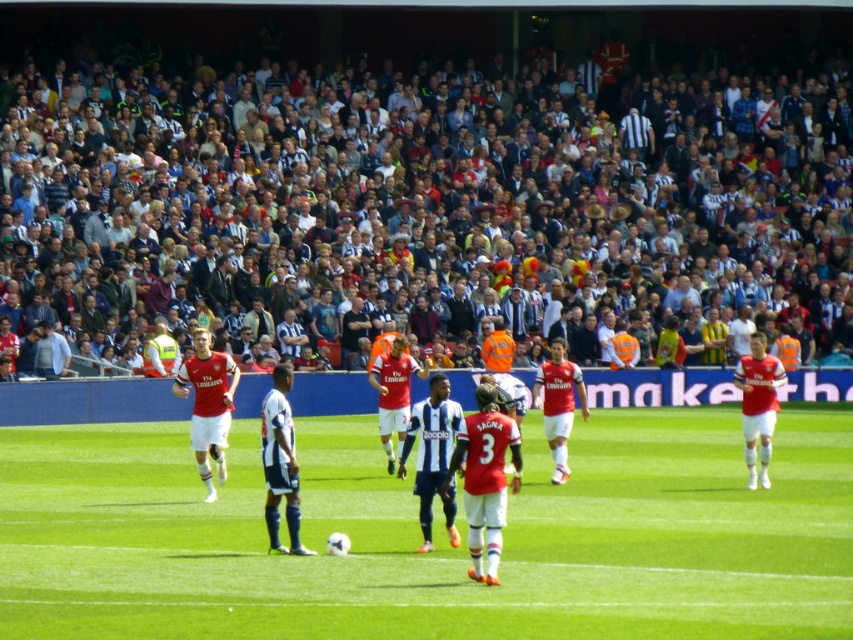
The width and height of the screenshot is (853, 640). Describe the element at coordinates (433, 536) in the screenshot. I see `white smooth soccer ball at center` at that location.

Measure the distance between point (793,576) and camera.

A distance of 17.58 meters exists between point (793,576) and camera.

The image size is (853, 640). In order to click on white smooth soccer ball at center in this screenshot , I will do `click(433, 536)`.

Between blue fabric crowd at upper center and white smooth soccer ball at center, which one appears on the right side from the viewer's perspective?

blue fabric crowd at upper center is more to the right.

Does blue fabric crowd at upper center have a greater height compared to white smooth soccer ball at center?

Yes.

The width and height of the screenshot is (853, 640). I want to click on blue fabric crowd at upper center, so click(437, 221).

Can you confirm if blue fabric crowd at upper center is thinner than white striped jersey at center?

In fact, blue fabric crowd at upper center might be wider than white striped jersey at center.

Between blue fabric crowd at upper center and white striped jersey at center, which one is positioned lower?

white striped jersey at center is lower down.

Does point (212, 131) come behind point (268, 392)?

Yes.

You are a GUI agent. You are given a task and a screenshot of the screen. Output one action in this format:
    pyautogui.click(x=<x>, y=<y>)
    Task: Click on the blue fabric crowd at upper center
    
    Given the screenshot: What is the action you would take?
    pyautogui.click(x=437, y=221)